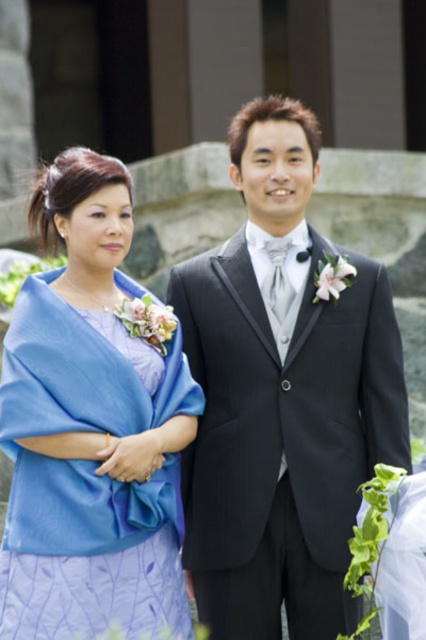
You are planning to arrange a photo shoot and need to place both the shiny black suit at center and the lavender satin dress at left in the frame. Which of the two has a wider silhouette?

The shiny black suit at center has a wider silhouette than the lavender satin dress at left, as its width surpasses that of the lavender satin dress at left.

You are a photographer at a wedding venue. You need to position the shiny black suit at center and the lavender satin dress at left in such a way that both are visible in the photo. Based on their current positions, which one is closer to the camera?

The shiny black suit at center is closer to the camera because the lavender satin dress at left is behind it.